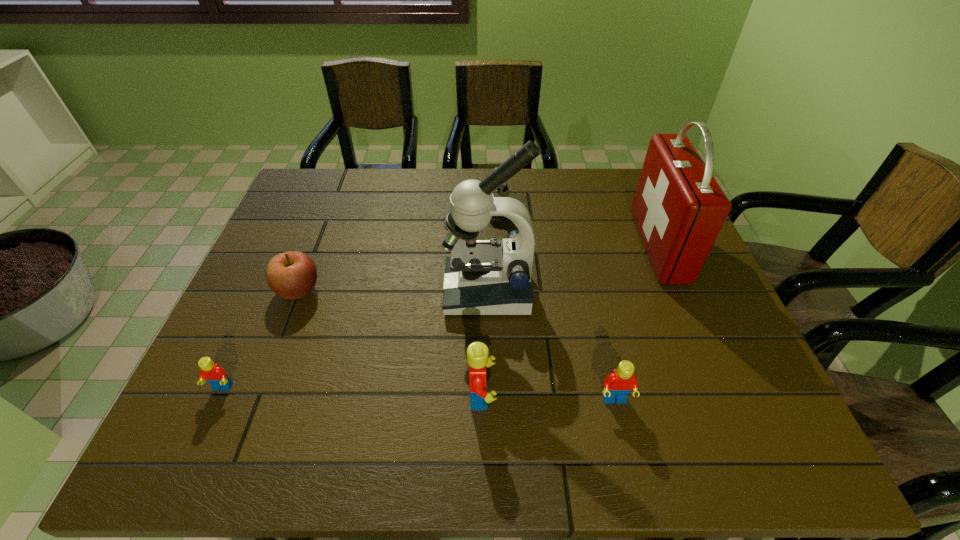
Where is `free space for an extra Lego to achieve even spacing`? Image resolution: width=960 pixels, height=540 pixels. free space for an extra Lego to achieve even spacing is located at coordinates (351, 392).